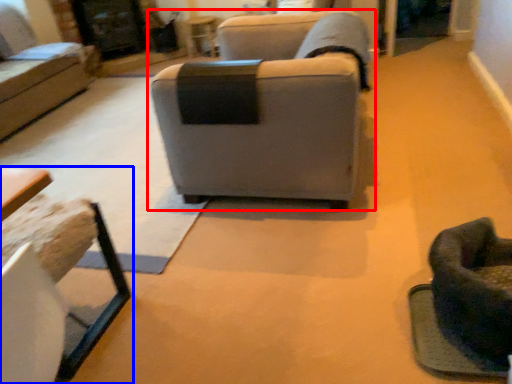
Question: Which object appears farthest to the camera in this image, studio couch (highlighted by a red box) or table (highlighted by a blue box)?

Choices:
 (A) studio couch
 (B) table

Answer: (A)